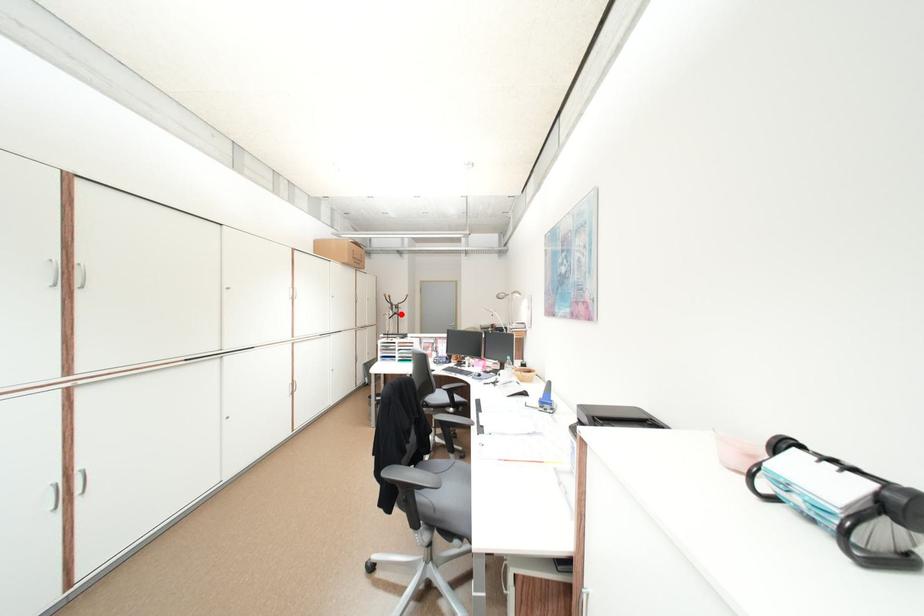
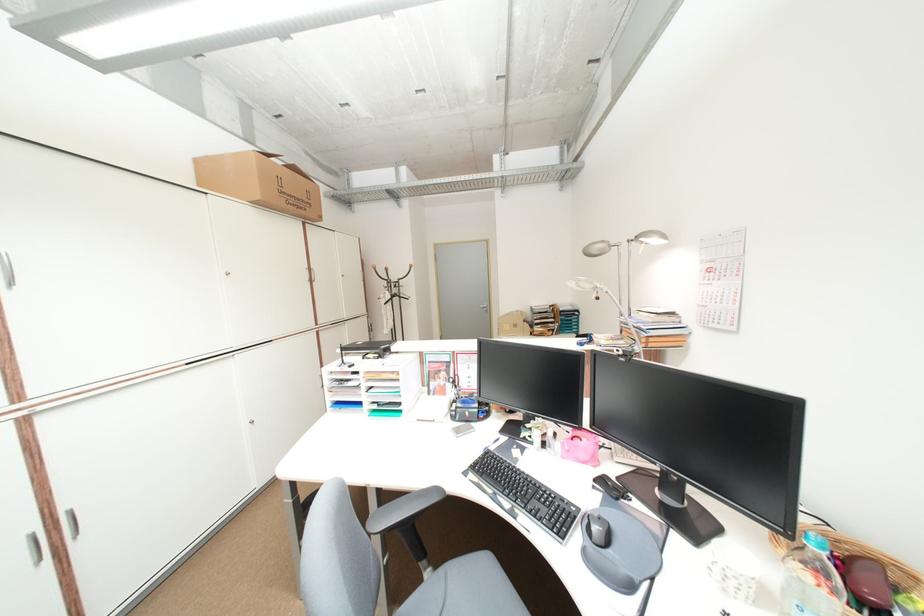
Locate, in the second image, the point that corresponds to the highlighted location in the first image.

(397, 296)